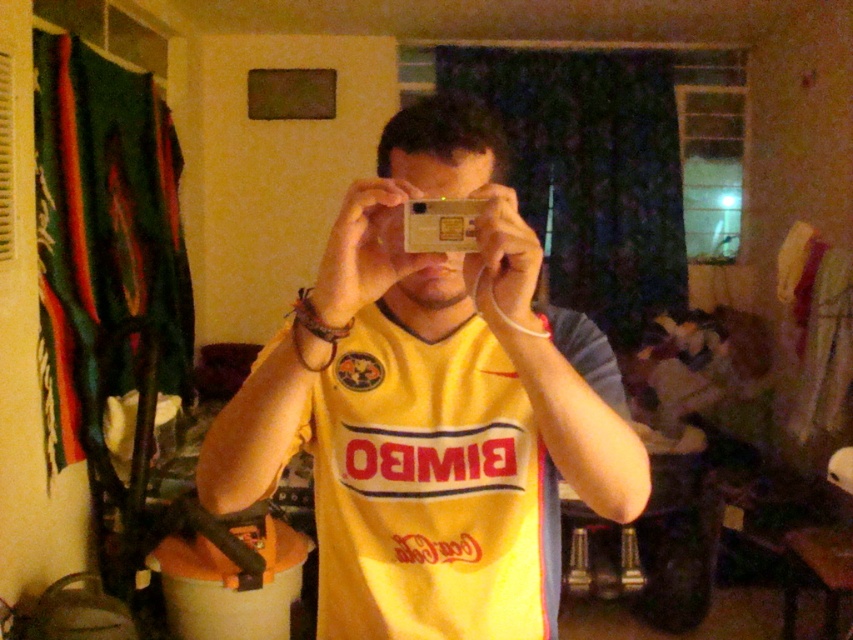
Does point (352, 419) lie in front of point (463, 205)?

No, (352, 419) is further to viewer.

This screenshot has height=640, width=853. Identify the location of yellow jersey at center. pyautogui.click(x=432, y=406).